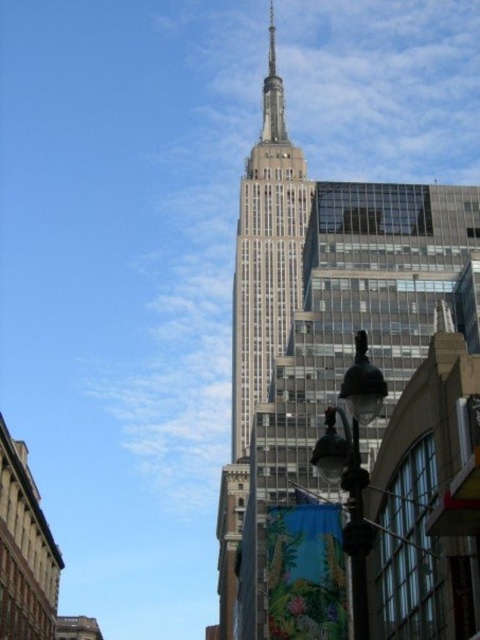
Does white stone tower at center have a lesser width compared to polished steel spire at center?

No, white stone tower at center is not thinner than polished steel spire at center.

Locate an element on the screen. This screenshot has height=640, width=480. white stone tower at center is located at coordinates (265, 253).

Locate an element on the screen. This screenshot has height=640, width=480. white glass skyscraper at center is located at coordinates (324, 332).

Does point (385, 275) come behind point (242, 241)?

No, (385, 275) is closer to viewer.

Which is in front, point (276, 394) or point (259, 170)?

Positioned in front is point (276, 394).

I want to click on white glass skyscraper at center, so click(x=324, y=332).

Does point (423, 621) come in front of point (279, 115)?

Yes, it is in front of point (279, 115).

Does white glass skyscraper at center appear under polished steel spire at center?

Correct, white glass skyscraper at center is located below polished steel spire at center.

In order to click on white glass skyscraper at center in this screenshot , I will do [324, 332].